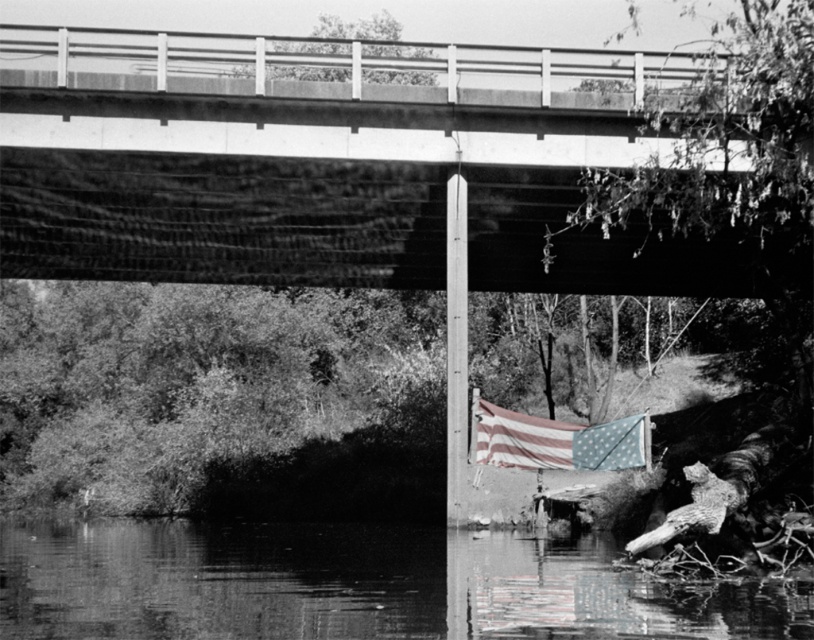
Who is more forward, (403, 586) or (648, 460)?

Point (403, 586) is in front.

Is point (28, 577) closer to camera compared to point (570, 444)?

Yes, it is in front of point (570, 444).

Between point (357, 625) and point (484, 442), which one is positioned in front?

Point (357, 625) is in front.

The width and height of the screenshot is (814, 640). What are the coordinates of `smooth water at lower center` in the screenshot? It's located at (352, 586).